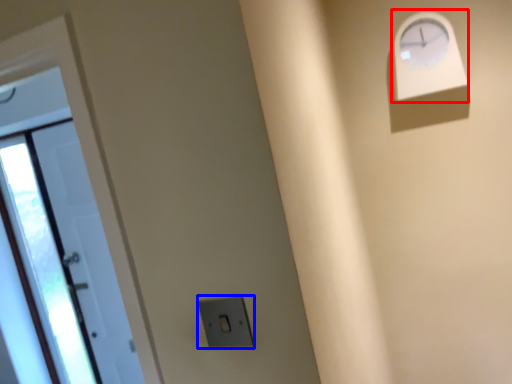
Question: Which object is closer to the camera taking this photo, clock (highlighted by a red box) or electric outlet (highlighted by a blue box)?

Choices:
 (A) clock
 (B) electric outlet

Answer: (B)